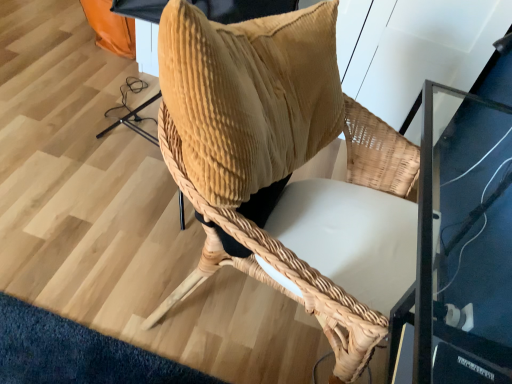
I want to click on vacant region under woven wood chair at center (from a real-world perspective), so click(x=248, y=324).